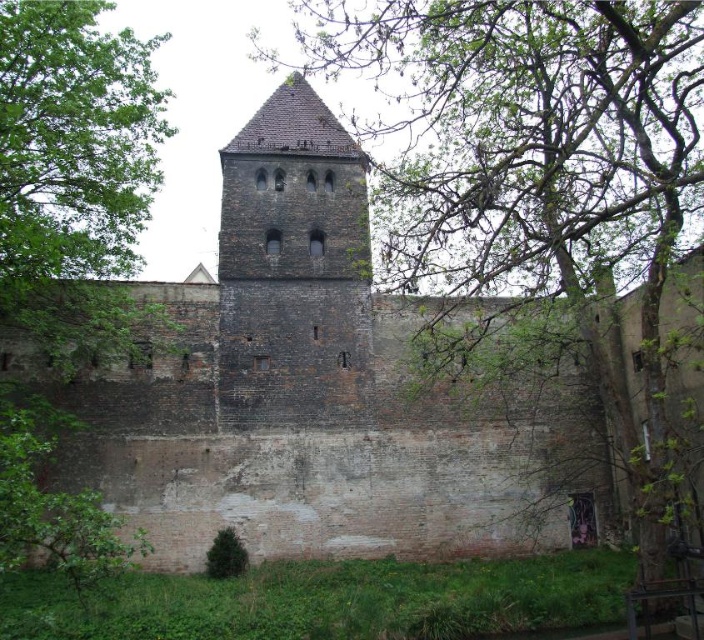
Can you confirm if green leafy tree at upper center is smaller than green leafy tree at left?

Actually, green leafy tree at upper center might be larger than green leafy tree at left.

In the scene shown: Is green leafy tree at upper center wider than green leafy tree at left?

Correct, the width of green leafy tree at upper center exceeds that of green leafy tree at left.

Which is in front, point (522, 221) or point (149, 84)?

Point (522, 221) is more forward.

The height and width of the screenshot is (640, 704). In order to click on green leafy tree at upper center in this screenshot , I will do `click(540, 173)`.

Does green leafy tree at left have a lesser width compared to green leafy tree at lower left?

No.

Where is `green leafy tree at left`? The image size is (704, 640). green leafy tree at left is located at coordinates (73, 173).

Can you confirm if green leafy tree at upper center is thinner than green leafy tree at lower left?

Incorrect, green leafy tree at upper center's width is not less than green leafy tree at lower left's.

From the picture: Who is more distant from viewer, [627,432] or [63,548]?

The point [627,432] is more distant.

Locate an element on the screen. Image resolution: width=704 pixels, height=640 pixels. green leafy tree at upper center is located at coordinates (540, 173).

Identify the location of green leafy tree at upper center. Image resolution: width=704 pixels, height=640 pixels. (540, 173).